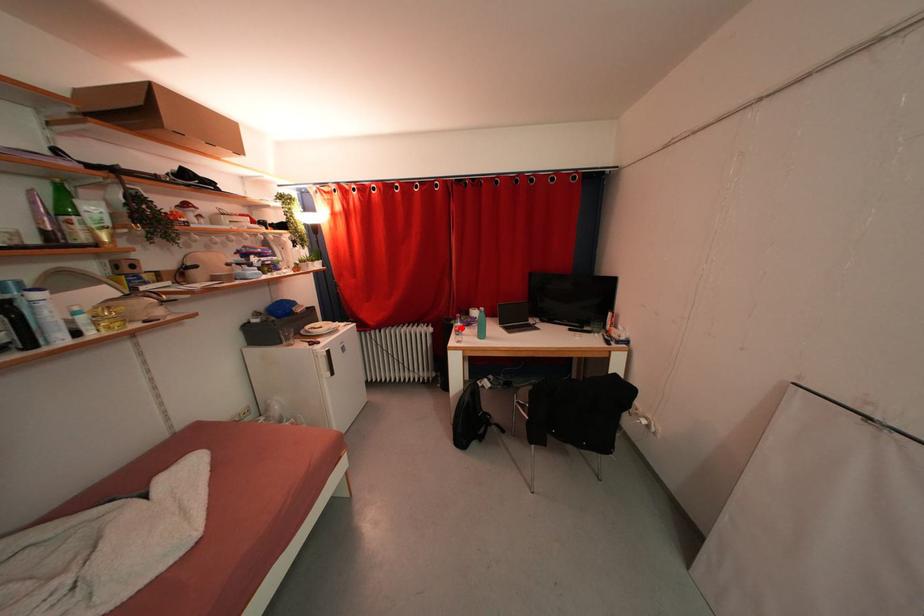
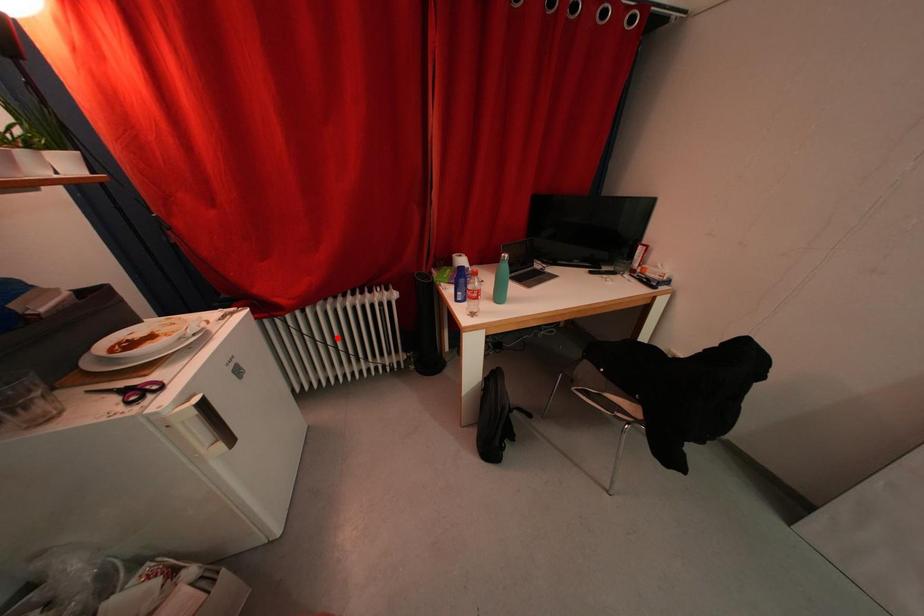
I am providing you with two images of the same scene from different viewpoints. A red point is marked on the first image and another point is marked on the second image. Is the marked point in image1 the same physical position as the marked point in image2?

No